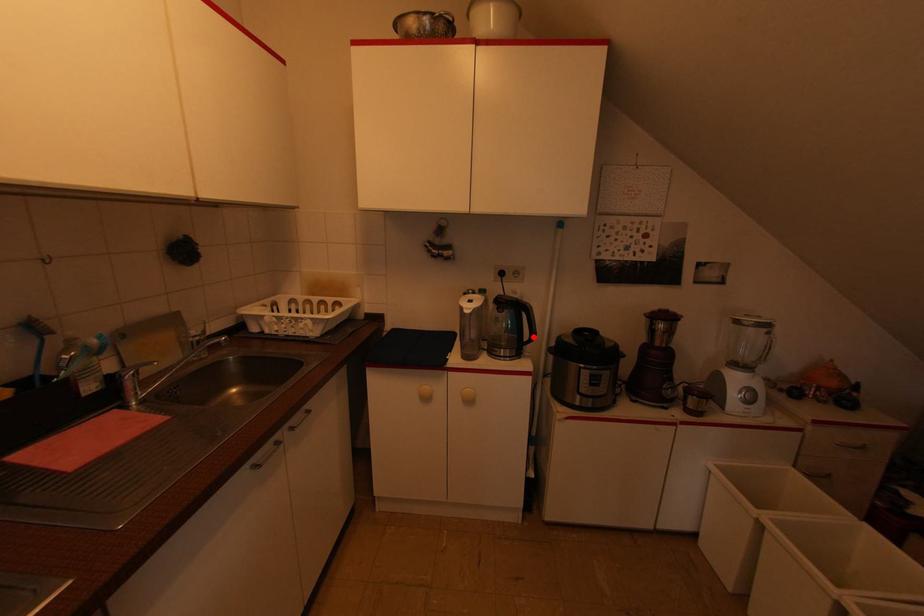
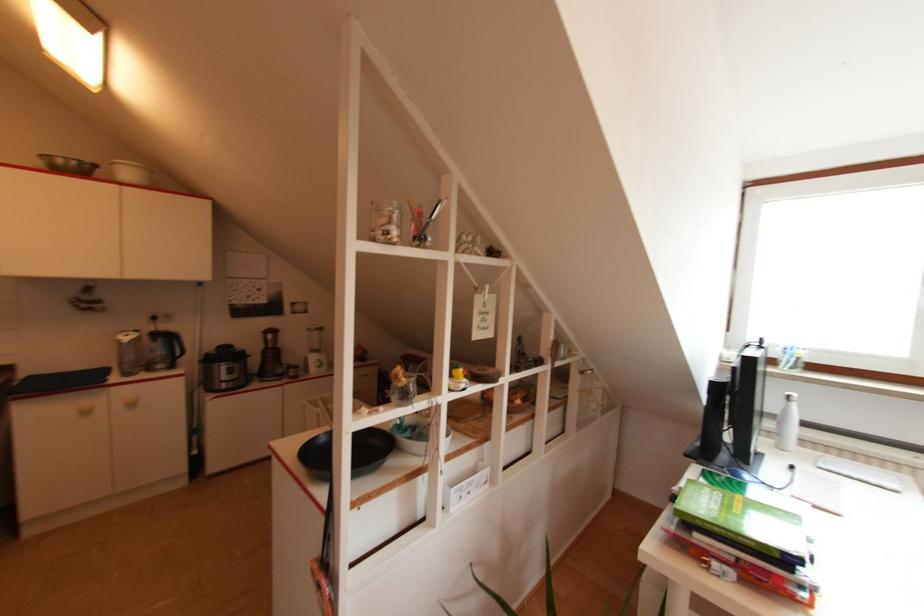
Question: I am providing you with two images of the same scene from different viewpoints. A red point is marked on the first image. At the location where the point appears in image 1, is it still visible in image 2?

Choices:
 (A) Yes
 (B) No

Answer: (A)